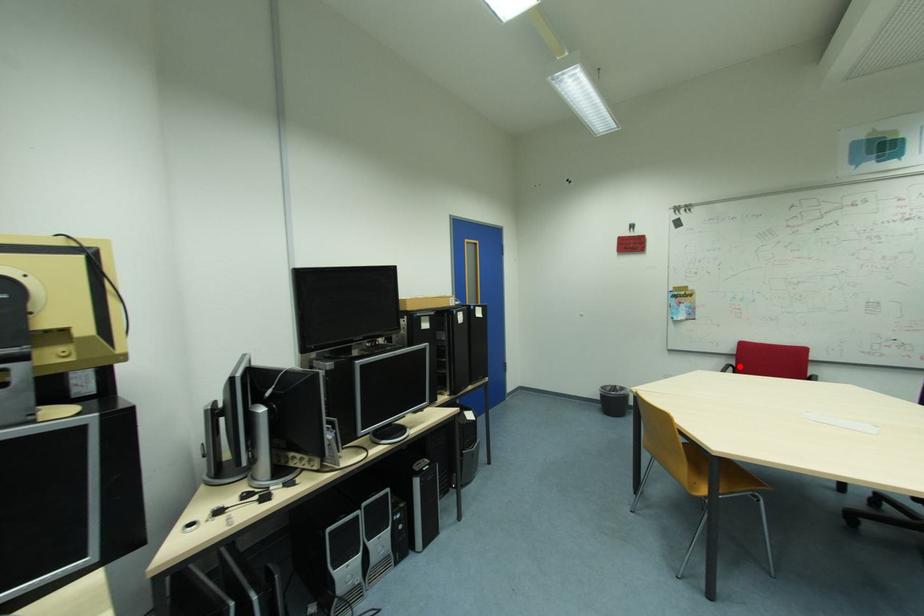
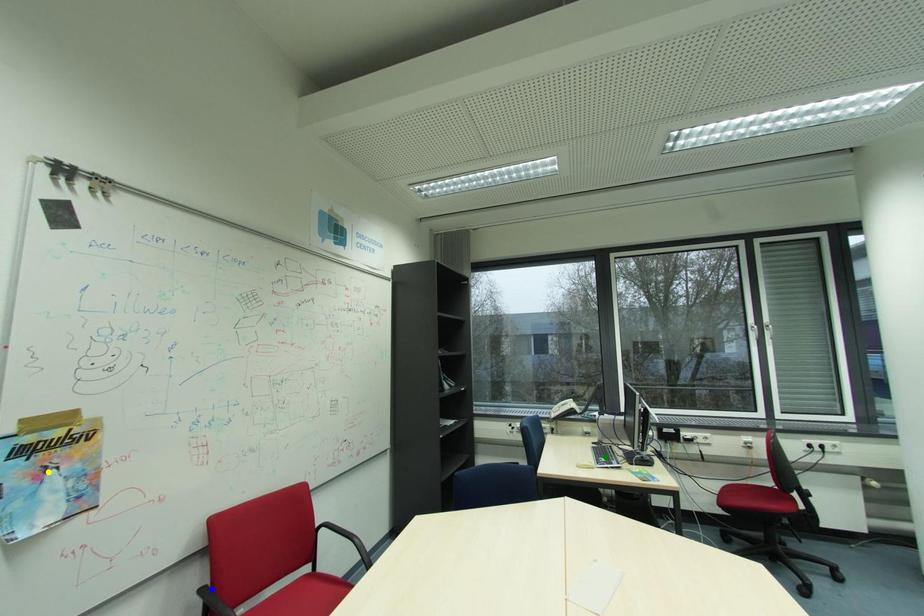
Question: I am providing you with two images of the same scene from different viewpoints. A red point is marked on the first image. You are given multiple points on the second image. Which spot in image 2 lines up with the point in image 1?

Choices:
 (A) green point
 (B) blue point
 (C) yellow point

Answer: (B)